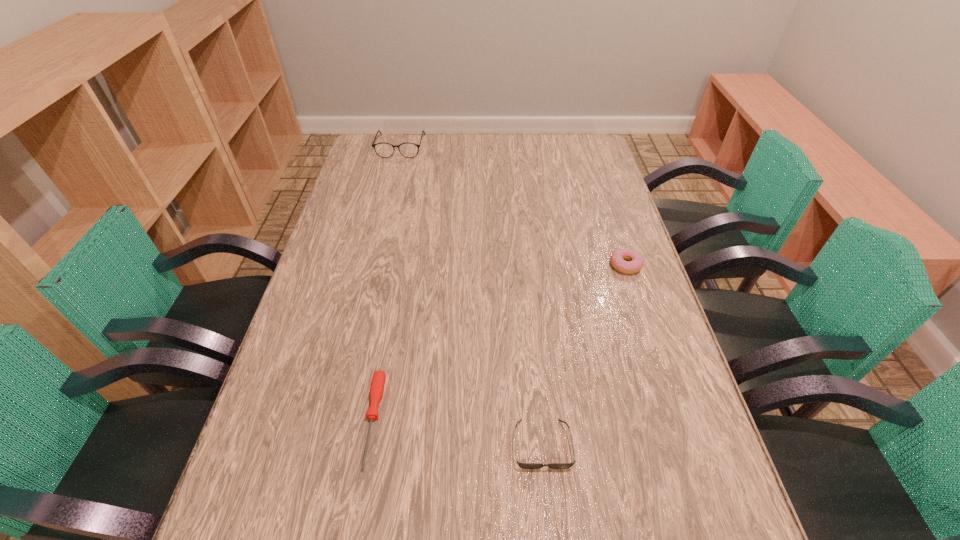
Find the location of a particular element. vacant region between the shortest object and the third object from left to right is located at coordinates (458, 432).

Find the location of `free spot between the third object from left to right and the third shortest object`. free spot between the third object from left to right and the third shortest object is located at coordinates (584, 355).

Image resolution: width=960 pixels, height=540 pixels. I want to click on free point between the second tallest object and the spectacles, so click(x=513, y=206).

Locate an element on the screen. free space that is in between the spectacles and the second farthest object is located at coordinates (513, 206).

Image resolution: width=960 pixels, height=540 pixels. What are the coordinates of `empty space between the screwdriver and the tallest object` in the screenshot? It's located at (387, 283).

At what (x,y) coordinates should I click in order to perform the action: click on empty location between the sunglasses and the shortest object. Please return your answer as a coordinate pair (x, y). This screenshot has height=540, width=960. Looking at the image, I should click on (458, 432).

The height and width of the screenshot is (540, 960). I want to click on vacant space that's between the sunglasses and the doughnut, so click(x=584, y=355).

Select which object is the closest to the third nearest object. Please provide its 2D coordinates. Your answer should be formatted as a tuple, i.e. [(x, y)], where the tuple contains the x and y coordinates of a point satisfying the conditions above.

[(522, 465)]

Identify which object is the third closest to the third object from left to right. Please provide its 2D coordinates. Your answer should be formatted as a tuple, i.e. [(x, y)], where the tuple contains the x and y coordinates of a point satisfying the conditions above.

[(385, 150)]

The width and height of the screenshot is (960, 540). I want to click on vacant space that satisfies the following two spatial constraints: 1. on the front-facing side of the tallest object; 2. on the right side of the rightmost object, so click(x=372, y=265).